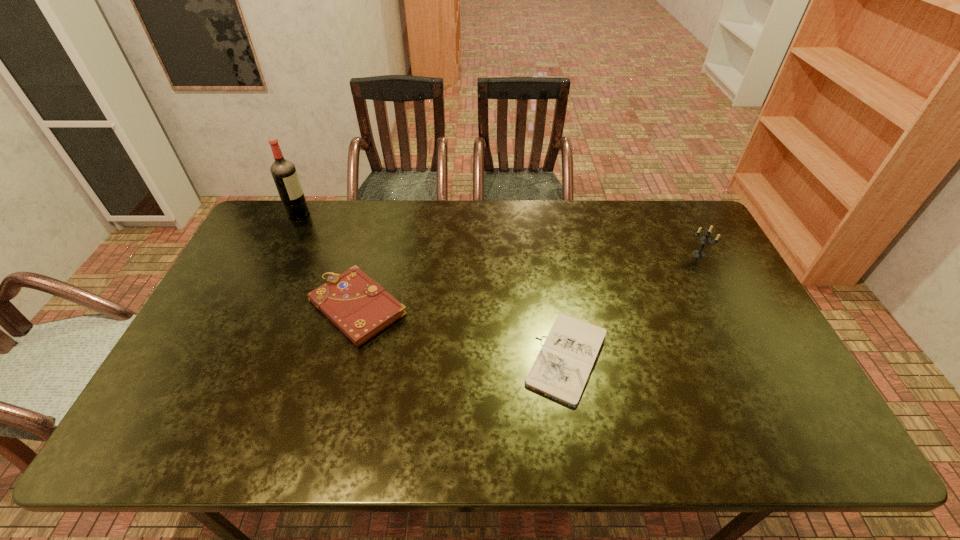
At what (x,y) coordinates should I click in order to perform the action: click on the farthest object. Please return your answer as a coordinate pair (x, y). The height and width of the screenshot is (540, 960). Looking at the image, I should click on (284, 173).

Find the location of a particular element. the tallest object is located at coordinates (284, 173).

The height and width of the screenshot is (540, 960). What are the coordinates of `the third nearest object` in the screenshot? It's located at (704, 240).

Where is `the rightmost object`? the rightmost object is located at coordinates (704, 240).

The width and height of the screenshot is (960, 540). I want to click on the third object from right to left, so click(x=358, y=306).

Where is `the taller notebook`? The image size is (960, 540). the taller notebook is located at coordinates (358, 306).

Locate an element on the screen. The image size is (960, 540). the third object from left to right is located at coordinates (561, 371).

This screenshot has height=540, width=960. I want to click on the shortest object, so click(x=561, y=371).

Locate an element on the screen. The width and height of the screenshot is (960, 540). vacant region located 0.400m on the front-facing side of the farthest object is located at coordinates (420, 213).

Where is `blank space located on the back of the third nearest object`? This screenshot has width=960, height=540. blank space located on the back of the third nearest object is located at coordinates (685, 228).